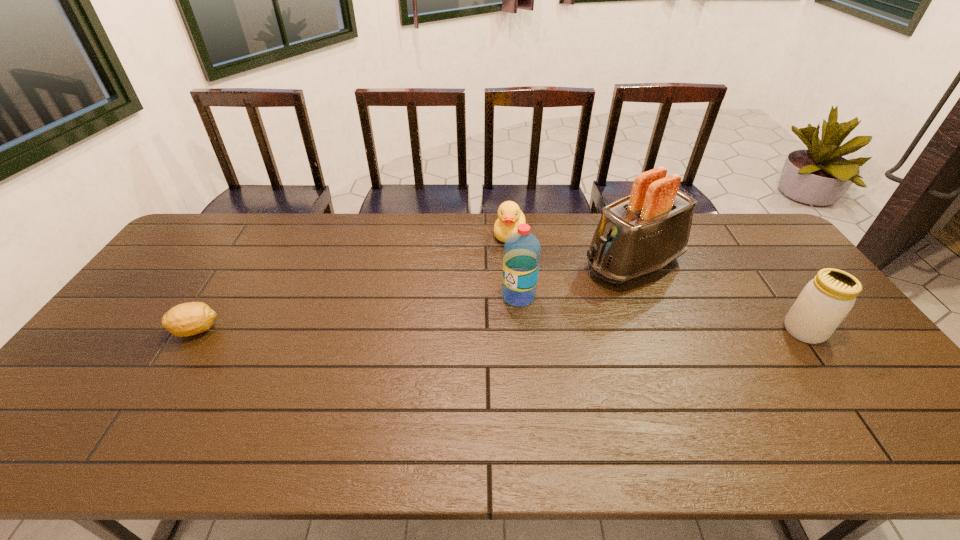
At what (x,y) coordinates should I click in order to perform the action: click on vacant area situated 0.120m at the stem end of the shortest object. Please return your answer as a coordinate pair (x, y). Looking at the image, I should click on (132, 330).

I want to click on vacant space located on the back of the rightmost object, so [755, 262].

At what (x,y) coordinates should I click in order to perform the action: click on vacant space located at the beak of the second shortest object. Please return your answer as a coordinate pair (x, y). Looking at the image, I should click on (499, 258).

The height and width of the screenshot is (540, 960). I want to click on free space located 0.390m at the beak of the second shortest object, so click(x=463, y=329).

The height and width of the screenshot is (540, 960). I want to click on vacant space located at the beak of the second shortest object, so click(474, 307).

Find the location of a particular element. This screenshot has width=960, height=540. vacant region located 0.180m on the front label of the water bottle is located at coordinates (458, 334).

The image size is (960, 540). Identify the location of blank space located on the front label of the water bottle. (474, 323).

This screenshot has width=960, height=540. Find the location of `vacant area located 0.340m on the front label of the water bottle`. vacant area located 0.340m on the front label of the water bottle is located at coordinates (409, 364).

I want to click on vacant space located on the side of the toaster with the control lever, so click(499, 322).

At what (x,y) coordinates should I click in order to perform the action: click on blank area located on the side of the toaster with the control lever. Please return your answer as a coordinate pair (x, y). The width and height of the screenshot is (960, 540). Looking at the image, I should click on (540, 303).